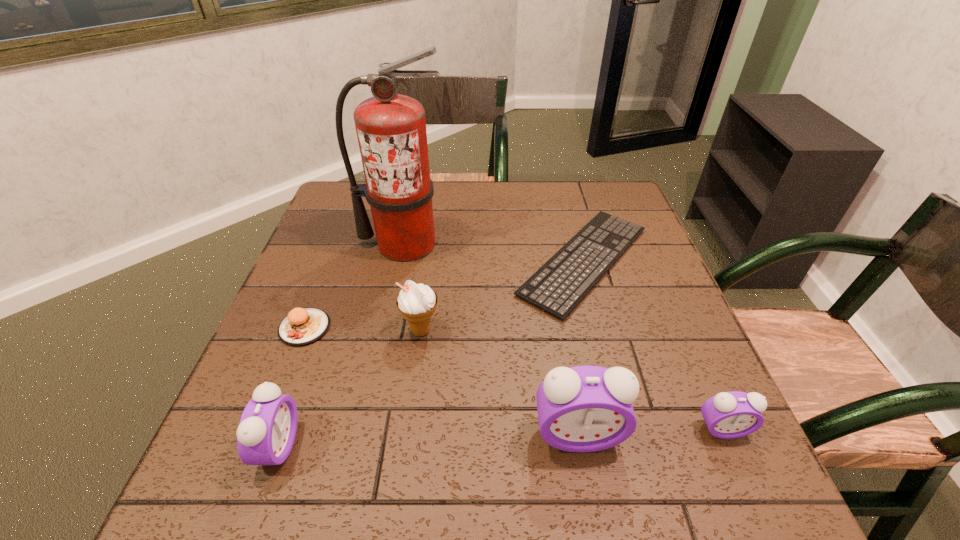
This screenshot has height=540, width=960. Identify the location of object situated at the near left corner. (266, 433).

Locate an element on the screen. This screenshot has width=960, height=540. object located at the far right corner is located at coordinates (585, 266).

Locate an element on the screen. object located in the near right corner section of the desktop is located at coordinates (728, 415).

The height and width of the screenshot is (540, 960). In the image, there is a desktop. Find the location of `vacant area at the far edge`. vacant area at the far edge is located at coordinates (509, 204).

You are a GUI agent. You are given a task and a screenshot of the screen. Output one action in this format:
    pyautogui.click(x=<x>, y=<y>)
    Task: Click on the free space at the near edge
    
    Given the screenshot: What is the action you would take?
    pyautogui.click(x=433, y=408)

Where is `vacant space at the right edge`? The width and height of the screenshot is (960, 540). vacant space at the right edge is located at coordinates pos(688,377).

Find the location of a particular element. This screenshot has width=960, height=540. free space at the far left corner is located at coordinates (341, 191).

At what (x,y) coordinates should I click in order to perform the action: click on free space at the far right corner of the desktop. Please return your answer as a coordinate pair (x, y). Looking at the image, I should click on (633, 206).

Identify the location of vacant space that is in between the sixth tallest object and the fire extinguisher. (354, 286).

At what (x,y) coordinates should I click in order to perform the action: click on vacant area that lies between the second shortest alarm clock and the icecream. Please return your answer as a coordinate pair (x, y). Looking at the image, I should click on (350, 388).